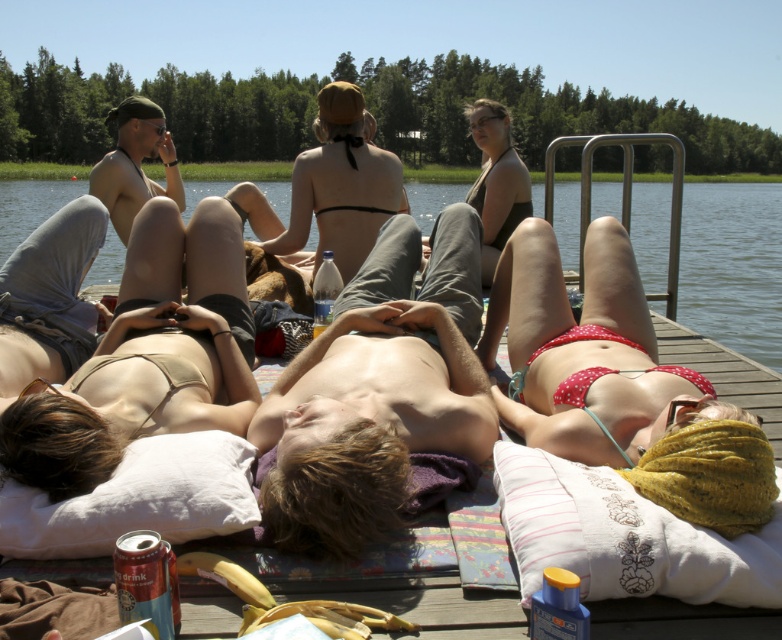
You are a photographer trying to capture the polka dot bikini at center and the black bikini at center in the same frame. Which bikini is closer to the camera?

The polka dot bikini at center is positioned under the black bikini at center, so the black bikini at center is closer to the camera.